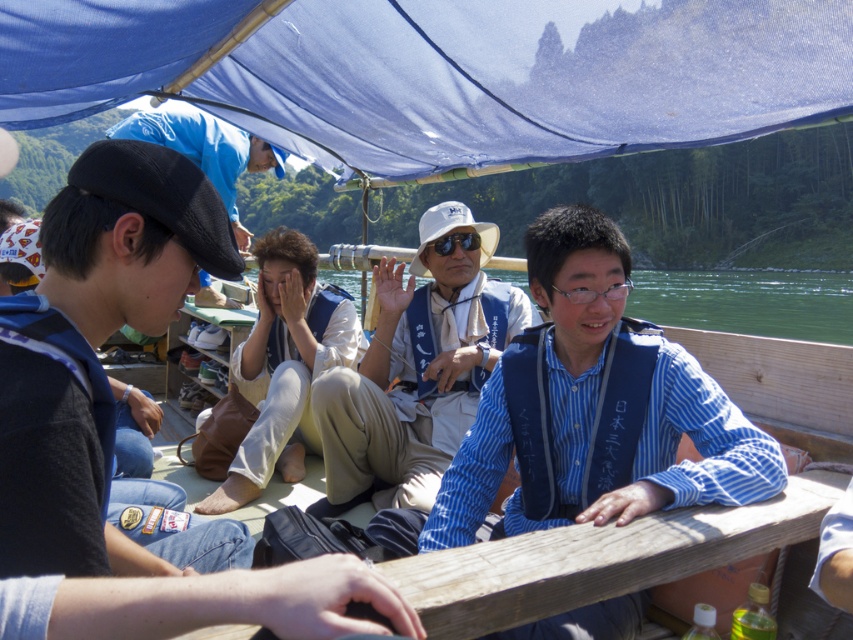
Question: Is dark blue denim jeans at left to the right of white fabric hat at center from the viewer's perspective?

Choices:
 (A) yes
 (B) no

Answer: (B)

Question: Can you confirm if dark blue denim jeans at left is wider than white cotton shirt at center?

Choices:
 (A) yes
 (B) no

Answer: (B)

Question: Is white cotton shirt at center in front of green water at center?

Choices:
 (A) no
 (B) yes

Answer: (A)

Question: Among these objects, which one is farthest from the camera?

Choices:
 (A) blue fabric canopy at upper center
 (B) green water at center

Answer: (A)

Question: Which point is farther to the camera?

Choices:
 (A) white cotton shirt at center
 (B) blue fabric canopy at upper center

Answer: (A)

Question: Which object is positioned farthest from the green water at center?

Choices:
 (A) blue striped shirt at center
 (B) white cotton shirt at center
 (C) white fabric hat at center
 (D) blue fabric canopy at upper center

Answer: (D)